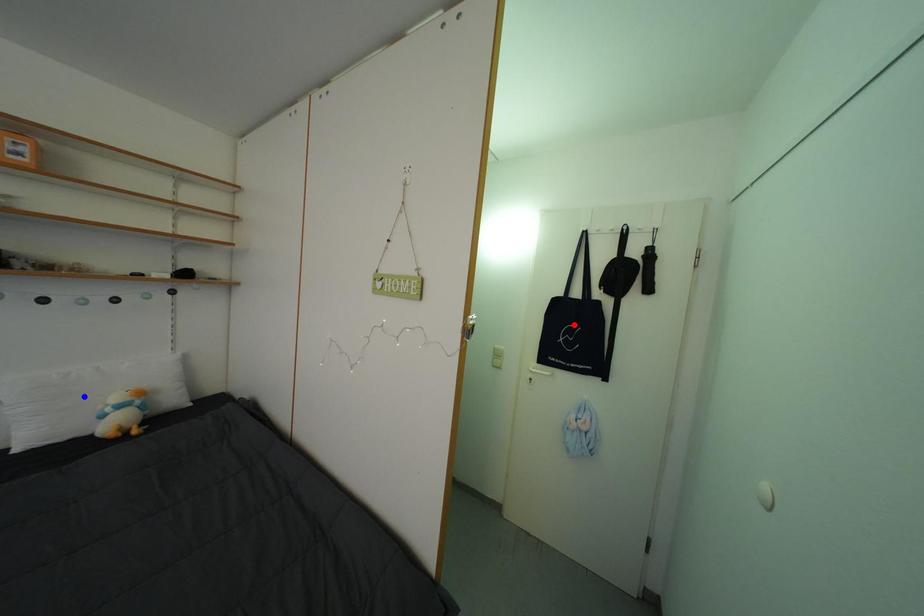
Question: Two points are marked on the image. Which point is closer to the camera?

Choices:
 (A) Blue point is closer.
 (B) Red point is closer.

Answer: (A)